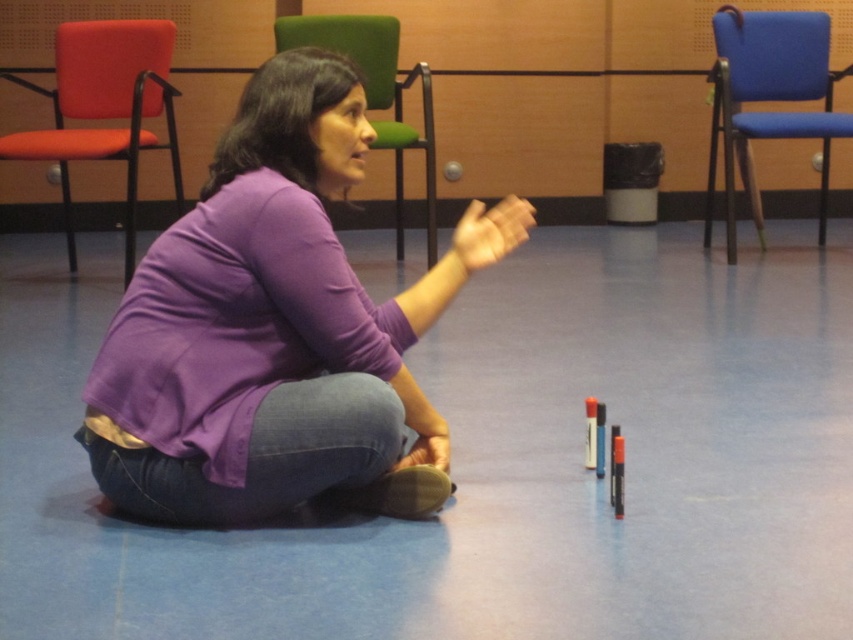
Question: Is purple soft shirt at center wider than blue fabric chair at right?

Choices:
 (A) no
 (B) yes

Answer: (B)

Question: Does purple soft shirt at center have a larger size compared to orange fabric chair at left?

Choices:
 (A) no
 (B) yes

Answer: (A)

Question: Which object is the farthest from the orange fabric chair at left?

Choices:
 (A) purple soft shirt at center
 (B) blue fabric chair at right

Answer: (B)

Question: Which is farther from the blue fabric chair at right?

Choices:
 (A) green fabric chair at upper center
 (B) orange fabric chair at left
 (C) purple soft shirt at center

Answer: (C)

Question: Which point is closer to the camera?

Choices:
 (A) (746, 81)
 (B) (61, 48)
 (C) (370, 364)
 (D) (404, 86)

Answer: (C)

Question: Does purple soft shirt at center appear on the right side of green fabric chair at upper center?

Choices:
 (A) yes
 (B) no

Answer: (A)